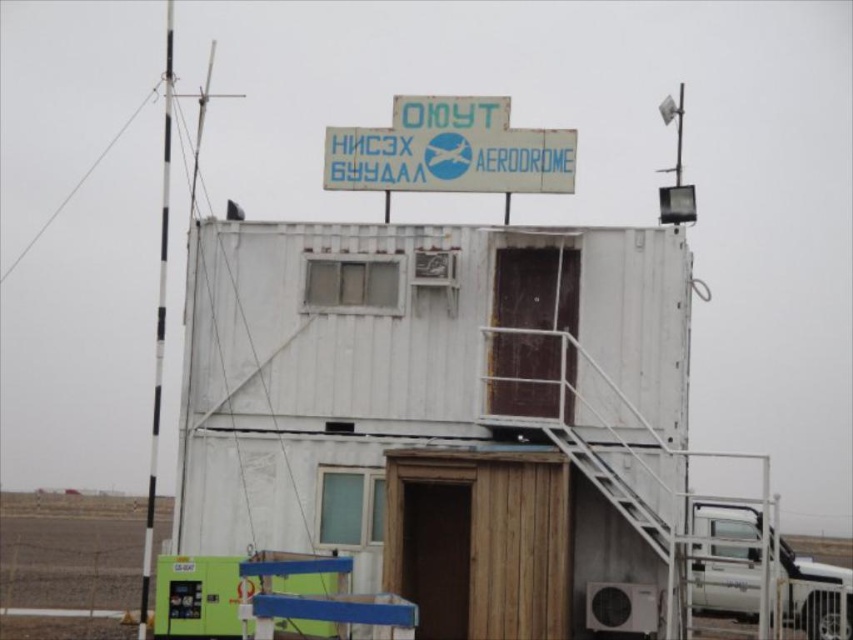
From the picture: Is white plastic sign at upper center below white metallic truck at lower right?

No, white plastic sign at upper center is not below white metallic truck at lower right.

The image size is (853, 640). Describe the element at coordinates (450, 150) in the screenshot. I see `white plastic sign at upper center` at that location.

Which is behind, point (363, 173) or point (811, 611)?

Point (811, 611)

Locate an element on the screen. white plastic sign at upper center is located at coordinates (450, 150).

Is point (286, 548) farther from viewer compared to point (445, 154)?

That is False.

Is point (288, 253) positioned after point (440, 168)?

That is True.

The width and height of the screenshot is (853, 640). What are the coordinates of `white wooden shed at center` in the screenshot? It's located at (442, 412).

Consider the image. Which of these two, white wooden shed at center or white metallic truck at lower right, stands taller?

white wooden shed at center is taller.

Measure the distance between white wooden shed at center and camera.

A distance of 12.68 meters exists between white wooden shed at center and camera.

The height and width of the screenshot is (640, 853). I want to click on white wooden shed at center, so click(x=442, y=412).